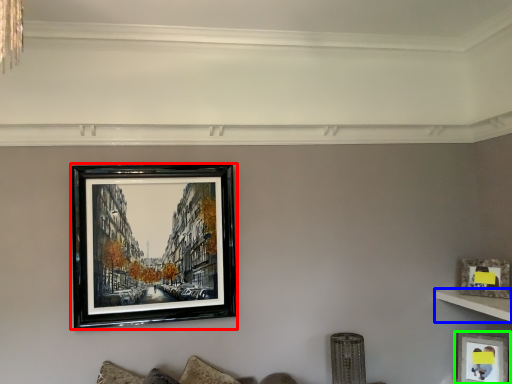
Question: Based on their relative distances, which object is farther from picture frame (highlighted by a red box)? Choose from shelf (highlighted by a blue box) and picture frame (highlighted by a green box).

Choices:
 (A) shelf
 (B) picture frame

Answer: (B)